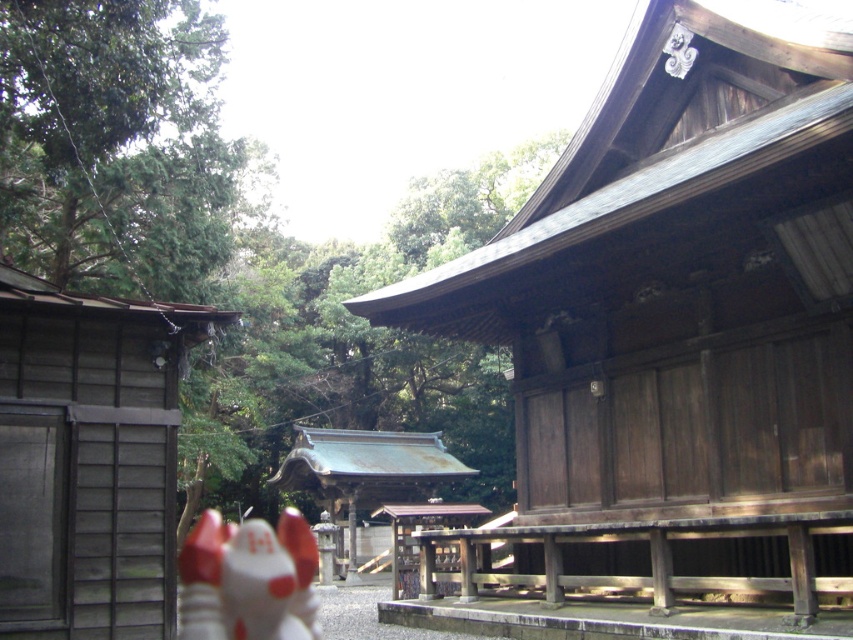
Question: Which of the following is the closest to the observer?

Choices:
 (A) (334, 451)
 (B) (248, 602)
 (C) (637, 209)
 (D) (120, 520)

Answer: (D)

Question: Does brown wooden hut at center appear over rusty metal shrine at center?

Choices:
 (A) yes
 (B) no

Answer: (A)

Question: Considering the real-world distances, which object is farthest from the wooden hut at left?

Choices:
 (A) rusty metal shrine at center
 (B) white glossy fox at lower left

Answer: (A)

Question: Which point is farther from the camera taking this photo?

Choices:
 (A) (305, 563)
 (B) (306, 484)

Answer: (B)

Question: Is wooden hut at left to the right of white glossy fox at lower left from the viewer's perspective?

Choices:
 (A) yes
 (B) no

Answer: (A)

Question: Does brown wooden hut at center have a larger size compared to white glossy fox at lower left?

Choices:
 (A) yes
 (B) no

Answer: (B)